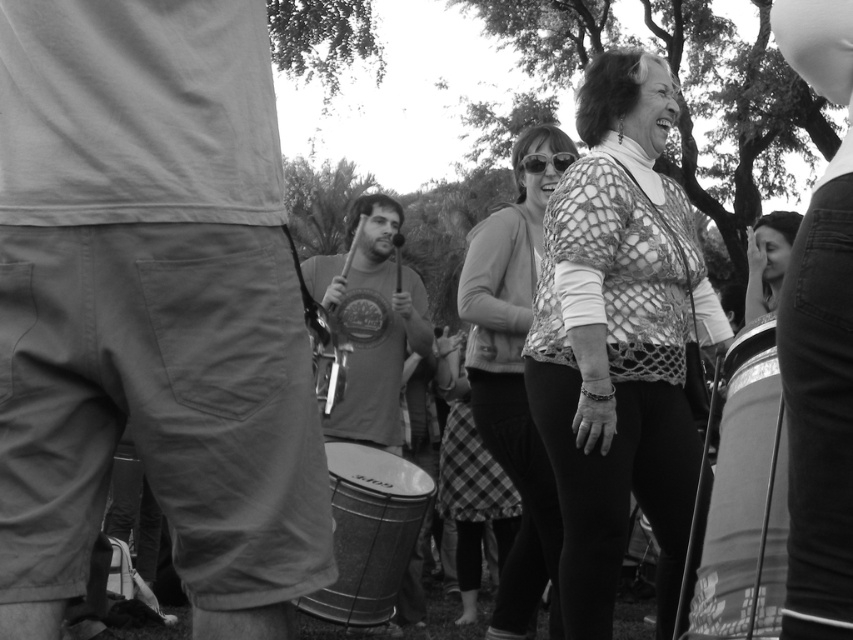
Which is in front, point (677, 332) or point (527, 596)?

Positioned in front is point (677, 332).

The width and height of the screenshot is (853, 640). What do you see at coordinates (618, 340) in the screenshot?
I see `crochet sweater at center` at bounding box center [618, 340].

Where is `crochet sweater at center`? This screenshot has height=640, width=853. crochet sweater at center is located at coordinates (618, 340).

Is the position of khaki cotton shorts at left less distant than that of netted fabric blouse at center?

Yes.

Is khaki cotton shorts at left wider than netted fabric blouse at center?

Correct, the width of khaki cotton shorts at left exceeds that of netted fabric blouse at center.

Locate an element on the screen. khaki cotton shorts at left is located at coordinates (151, 308).

Locate an element on the screen. The image size is (853, 640). khaki cotton shorts at left is located at coordinates (151, 308).

Between smooth drum at center and metallic drum at lower center, which one appears on the left side from the viewer's perspective?

From the viewer's perspective, metallic drum at lower center appears more on the left side.

Which of these two, smooth drum at center or metallic drum at lower center, stands shorter?

With less height is metallic drum at lower center.

Is point (337, 264) positioned after point (339, 472)?

Yes.

You are a GUI agent. You are given a task and a screenshot of the screen. Output one action in this format:
    pyautogui.click(x=<x>, y=<y>)
    Task: Click on the smooth drum at center
    The width and height of the screenshot is (853, 640).
    Given the screenshot: What is the action you would take?
    pyautogui.click(x=372, y=323)